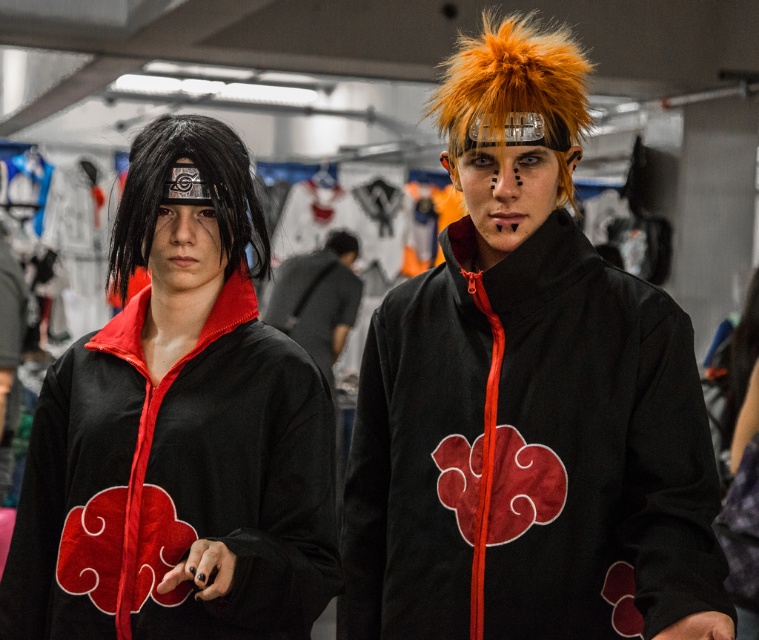
Question: Can you confirm if orange spiky wig at upper right is positioned to the left of black synthetic wig at left?

Choices:
 (A) no
 (B) yes

Answer: (A)

Question: Does velvet black jacket at upper right come in front of black synthetic wig at left?

Choices:
 (A) no
 (B) yes

Answer: (B)

Question: Estimate the real-world distances between objects in this image. Which object is farther from the black synthetic wig at left?

Choices:
 (A) matte black jacket at left
 (B) orange spiky wig at upper right

Answer: (B)

Question: Does velvet black jacket at upper right appear under orange spiky wig at upper right?

Choices:
 (A) yes
 (B) no

Answer: (A)

Question: Based on their relative distances, which object is nearer to the orange spiky wig at upper right?

Choices:
 (A) matte black jacket at left
 (B) matte black jacket at center
 (C) black synthetic wig at left
 (D) velvet black jacket at upper right

Answer: (D)

Question: Considering the real-world distances, which object is closest to the matte black jacket at left?

Choices:
 (A) orange spiky wig at upper right
 (B) black synthetic wig at left

Answer: (B)